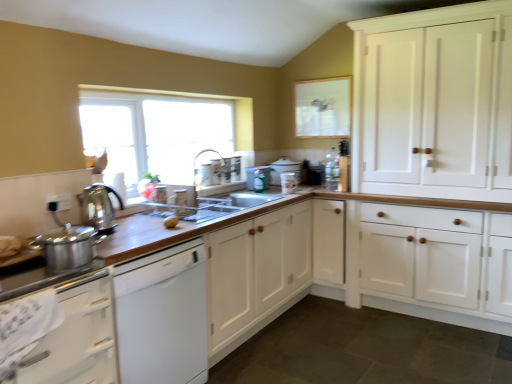
Question: From the image's perspective, relative to matte white mug at upper center, marked as the 2th appliance in a right-to-left arrangement, is satin silver kettle at left, positioned as the 6th appliance in right-to-left order, above or below?

Choices:
 (A) below
 (B) above

Answer: (A)

Question: Considering the positions of satin silver kettle at left, acting as the 6th appliance starting from the back, and matte white mug at upper center, acting as the third appliance starting from the front, in the image, is satin silver kettle at left, acting as the 6th appliance starting from the back, taller or shorter than matte white mug at upper center, acting as the third appliance starting from the front,?

Choices:
 (A) tall
 (B) short

Answer: (A)

Question: Which object is the closest to the metallic silver spray bottle at center, which is counted as the 3th appliance, starting from the back?

Choices:
 (A) shiny metallic pot at left
 (B) white wood cabinets at right, the 3th cabinetry viewed from the left
 (C) clear glass window screen at upper center
 (D) matte white mug at upper center, which is the 5th appliance from left to right
 (E) white wood cabinet at center, the 2th cabinetry from the left

Answer: (D)

Question: Estimate the real-world distances between objects in this image. Which object is closer to the white wood cabinets at right, acting as the first cabinetry starting from the right?

Choices:
 (A) wooden at left
 (B) clear glass window screen at upper center
 (C) satin silver kettle at left, acting as the 6th appliance starting from the back
 (D) silver metallic faucet at upper center
 (E) white wood cabinet at center, the 2th cabinetry from the left

Answer: (A)